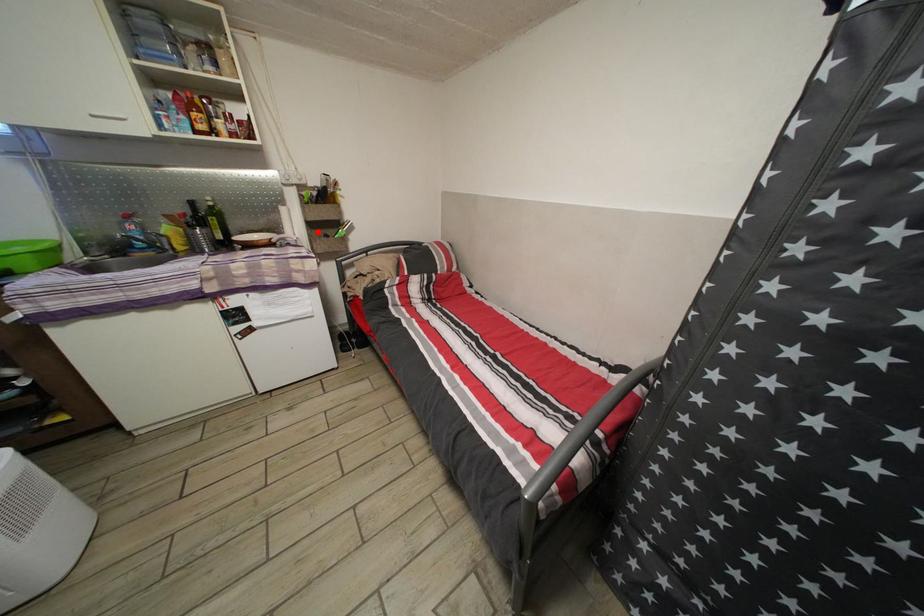
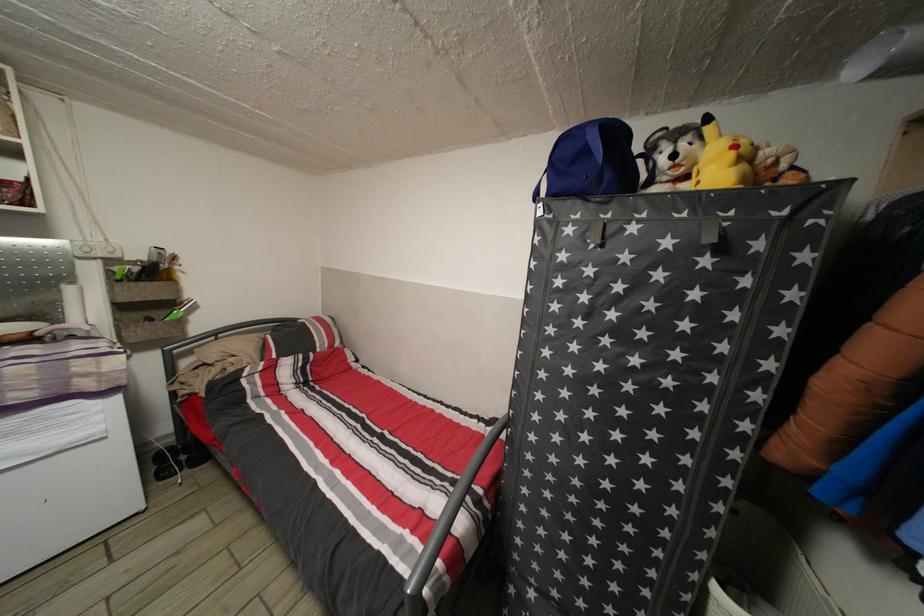
Question: I am providing you with two images of the same scene from different viewpoints. Given a red point in image1, look at the same physical point in image2. Is it:

Choices:
 (A) Closer to the viewpoint
 (B) Farther from the viewpoint

Answer: (B)